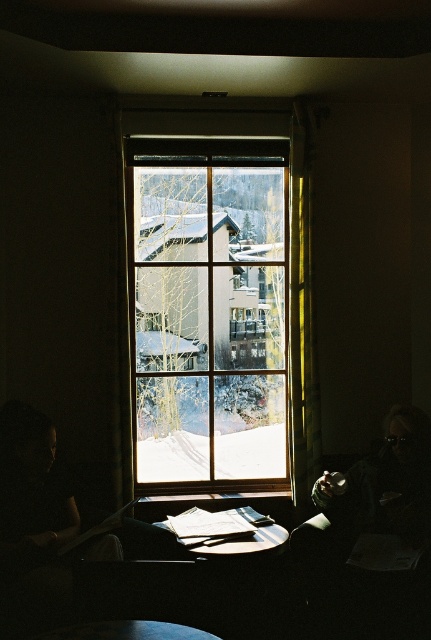
You are an interior designer planning to hang a large painting on the wall between the clear glass window at center and the yellow fabric curtain at right. Considering their widths, which object should you place the painting closer to to ensure it balances the space?

The clear glass window at center is wider than the yellow fabric curtain at right. To balance the space, the painting should be placed closer to the yellow fabric curtain at right since it is narrower, creating visual equilibrium.

You are arranging a small potted plant that is 10 cm wide between the yellow fabric curtain at right and the wooden table at center. Can the space between them accommodate the plant?

The yellow fabric curtain at right is thinner than the wooden table at center. However, the exact distance between them isn generated from the provided information, so it is impossible to determine if the space can accommodate the 10 cm wide potted plant.

You are trying to decide whether to place a large painting on the clear glass window at center or the wooden table at center. Based on their sizes, which surface can accommodate the painting better?

The clear glass window at center has a larger width than the wooden table at center, so it can accommodate the painting better.